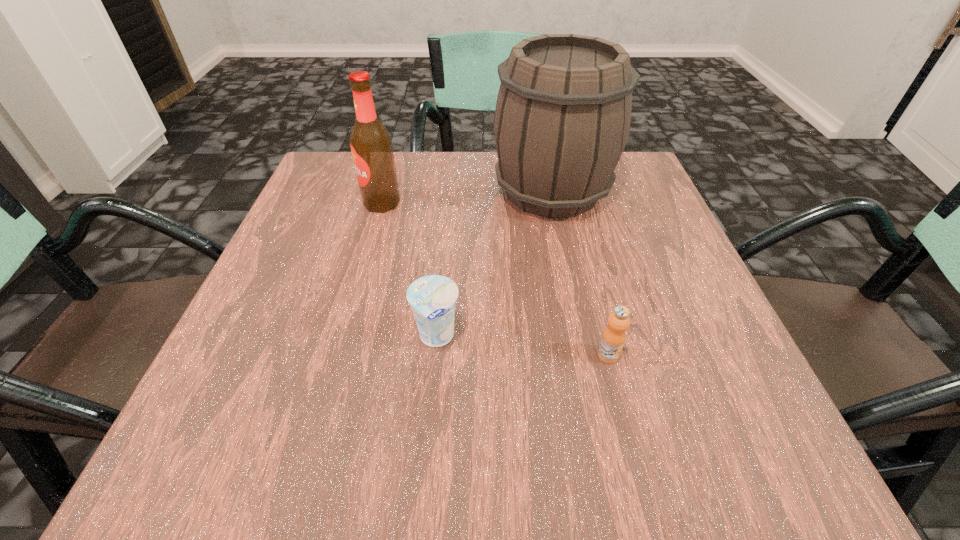
Where is `object that is positioned at the left edge`? The height and width of the screenshot is (540, 960). object that is positioned at the left edge is located at coordinates (371, 144).

What are the coordinates of `object at the right edge` in the screenshot? It's located at click(562, 119).

This screenshot has height=540, width=960. Identify the location of object present at the far left corner. (371, 144).

This screenshot has width=960, height=540. Identify the location of object present at the far right corner. (562, 119).

In the image, there is a desktop. Where is `blank space at the far edge`? This screenshot has height=540, width=960. blank space at the far edge is located at coordinates (399, 184).

Locate an element on the screen. The width and height of the screenshot is (960, 540). vacant space at the near edge is located at coordinates (305, 448).

Locate an element on the screen. This screenshot has width=960, height=540. free space at the left edge of the desktop is located at coordinates (315, 275).

In the image, there is a desktop. In order to click on blank space at the right edge in this screenshot , I will do `click(607, 280)`.

This screenshot has height=540, width=960. In the image, there is a desktop. What are the coordinates of `blank space at the far left corner` in the screenshot? It's located at (337, 191).

Identify the location of vacant space at the near left corner of the desktop. The width and height of the screenshot is (960, 540). [x=278, y=456].